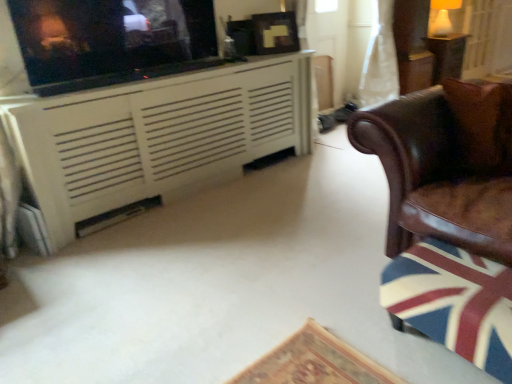
Question: Should I look upward or downward to see brown leather chair at right?

Choices:
 (A) up
 (B) down

Answer: (A)

Question: Is white glossy lampshade at upper right with matte black tv at upper left?

Choices:
 (A) yes
 (B) no

Answer: (B)

Question: Are white glossy lampshade at upper right and matte black tv at upper left far apart?

Choices:
 (A) no
 (B) yes

Answer: (B)

Question: From a real-world perspective, is white glossy lampshade at upper right on top of matte black tv at upper left?

Choices:
 (A) no
 (B) yes

Answer: (A)

Question: From a real-world perspective, is white glossy lampshade at upper right located beneath matte black tv at upper left?

Choices:
 (A) yes
 (B) no

Answer: (A)

Question: Is white glossy lampshade at upper right positioned behind matte black tv at upper left?

Choices:
 (A) yes
 (B) no

Answer: (A)

Question: Can you confirm if white glossy lampshade at upper right is wider than matte black tv at upper left?

Choices:
 (A) yes
 (B) no

Answer: (A)

Question: From a real-world perspective, is wooden table at upper right on white painted wood cabinet at upper left?

Choices:
 (A) yes
 (B) no

Answer: (B)

Question: Is wooden table at upper right positioned in front of white painted wood cabinet at upper left?

Choices:
 (A) yes
 (B) no

Answer: (B)

Question: Is wooden table at upper right smaller than white painted wood cabinet at upper left?

Choices:
 (A) yes
 (B) no

Answer: (A)

Question: Does wooden table at upper right have a greater width compared to white painted wood cabinet at upper left?

Choices:
 (A) no
 (B) yes

Answer: (A)

Question: Is wooden table at upper right at the left side of white painted wood cabinet at upper left?

Choices:
 (A) no
 (B) yes

Answer: (A)

Question: Considering the relative sizes of wooden table at upper right and white painted wood cabinet at upper left in the image provided, is wooden table at upper right thinner than white painted wood cabinet at upper left?

Choices:
 (A) yes
 (B) no

Answer: (A)

Question: From a real-world perspective, is white painted wood cabinet at upper left under white sheer curtain at upper right?

Choices:
 (A) no
 (B) yes

Answer: (B)